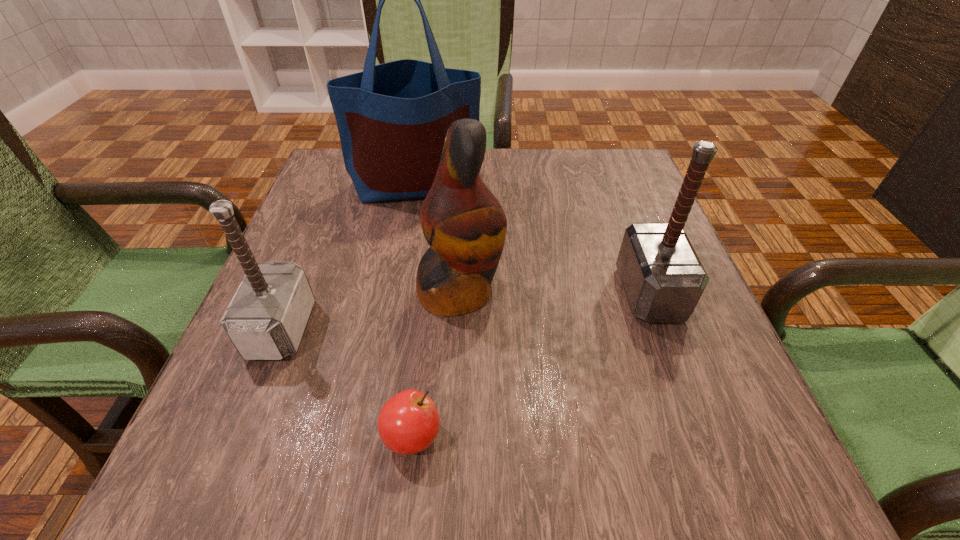
Identify the location of handbag. (392, 118).

Locate an element on the screen. The width and height of the screenshot is (960, 540). the farthest object is located at coordinates (392, 118).

Image resolution: width=960 pixels, height=540 pixels. Find the location of `parrot`. parrot is located at coordinates (464, 224).

You are a GUI agent. You are given a task and a screenshot of the screen. Output one action in this format:
    pyautogui.click(x=<x>, y=<y>)
    Task: Click on the rightmost object
    The width and height of the screenshot is (960, 540).
    Given the screenshot: What is the action you would take?
    pyautogui.click(x=663, y=278)

Locate an element on the screen. Image resolution: width=960 pixels, height=540 pixels. the left hammer is located at coordinates (265, 320).

Locate an element on the screen. the nearest object is located at coordinates (408, 423).

Where is `the shortest object`? Image resolution: width=960 pixels, height=540 pixels. the shortest object is located at coordinates (408, 423).

Locate an element on the screen. The height and width of the screenshot is (540, 960). free point located 0.270m on the front of the tallest object is located at coordinates (397, 294).

Where is `vacant space situated on the face of the parrot`? vacant space situated on the face of the parrot is located at coordinates (696, 291).

This screenshot has height=540, width=960. I want to click on blank space located on the left of the right hammer, so point(527,293).